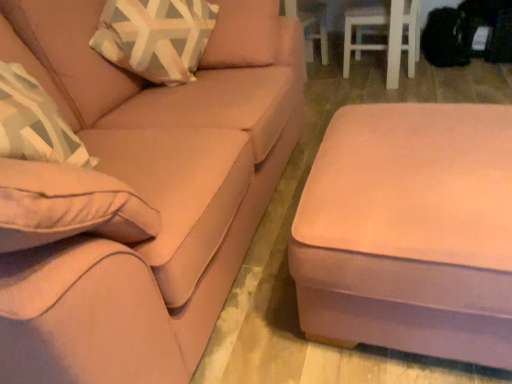
Question: Is point (506, 107) closer or farther from the camera than point (296, 92)?

Choices:
 (A) closer
 (B) farther

Answer: (A)

Question: From the image's perspective, relative to suede-like beige couch at center, is suede ottoman at lower right above or below?

Choices:
 (A) below
 (B) above

Answer: (A)

Question: Considering the positions of suede ottoman at lower right and suede-like beige couch at center in the image, is suede ottoman at lower right bigger or smaller than suede-like beige couch at center?

Choices:
 (A) big
 (B) small

Answer: (B)

Question: Would you say suede-like beige couch at center is to the left or to the right of suede ottoman at lower right in the picture?

Choices:
 (A) left
 (B) right

Answer: (A)

Question: Is point (20, 340) closer or farther from the camera than point (445, 150)?

Choices:
 (A) closer
 (B) farther

Answer: (A)

Question: From a real-world perspective, is suede-like beige couch at center positioned above or below suede ottoman at lower right?

Choices:
 (A) below
 (B) above

Answer: (B)

Question: Looking at their shapes, would you say suede-like beige couch at center is wider or thinner than suede ottoman at lower right?

Choices:
 (A) wide
 (B) thin

Answer: (A)